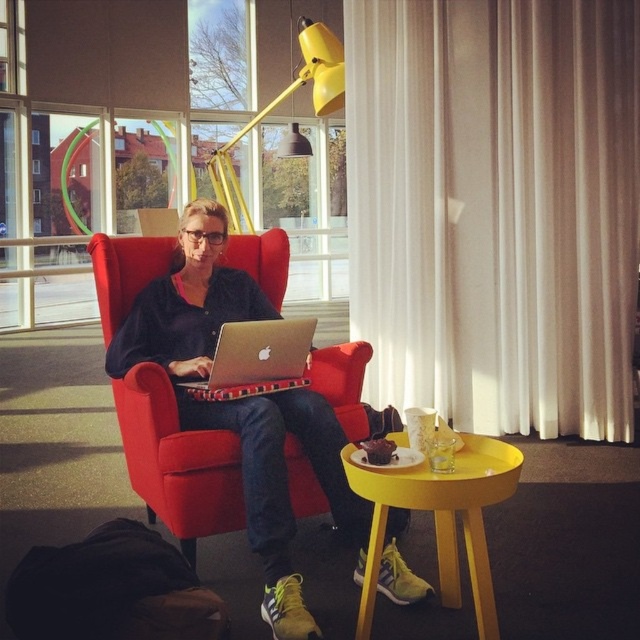
Is yellow matte table at lower center behind silver metallic laptop at center?

No, yellow matte table at lower center is in front of silver metallic laptop at center.

Which is behind, point (481, 451) or point (296, 346)?

Point (296, 346)

Is point (484, 636) farther from camera compared to point (307, 358)?

No, (484, 636) is in front of (307, 358).

Identify the location of yellow matte table at lower center. Image resolution: width=640 pixels, height=640 pixels. (442, 518).

Is black fabric bag at lower left thinner than silver metallic laptop at center?

No, black fabric bag at lower left is not thinner than silver metallic laptop at center.

Does black fabric bag at lower left lie in front of silver metallic laptop at center?

Yes, black fabric bag at lower left is closer to the viewer.

Is point (49, 596) positioned behind point (266, 326)?

No.

Where is `black fabric bag at lower left`? black fabric bag at lower left is located at coordinates (112, 589).

Is point (230, 324) positioned after point (276, 102)?

That is False.

Does silver metallic laptop at center appear on the left side of yellow matte lamp at upper center?

No, silver metallic laptop at center is not to the left of yellow matte lamp at upper center.

Who is more distant from viewer, [308,323] or [291,20]?

Point [291,20]

Find the location of a particular element. Image resolution: width=640 pixels, height=640 pixels. silver metallic laptop at center is located at coordinates (256, 358).